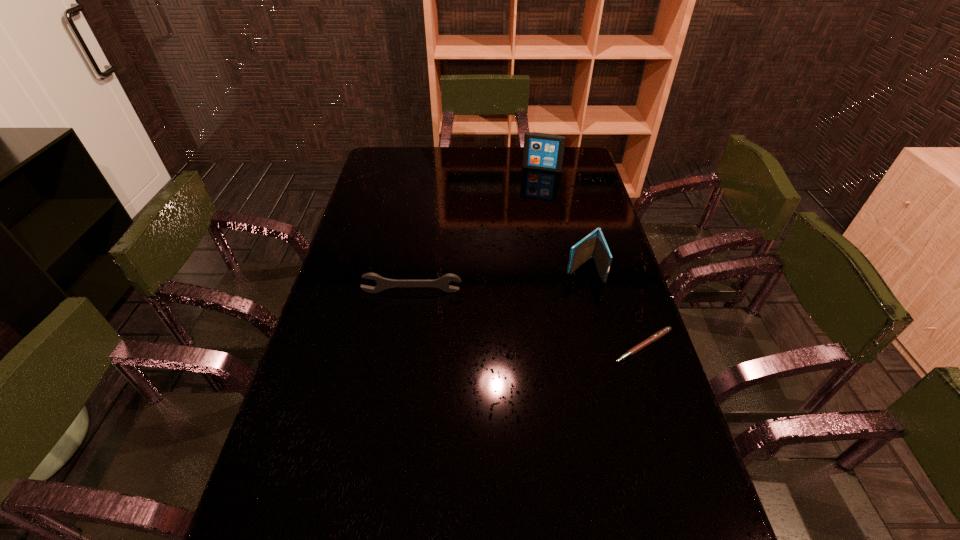
Locate an element on the screen. vacant space located 0.400m on the exterior surface of the wallet is located at coordinates (478, 350).

This screenshot has width=960, height=540. Identify the location of free space located on the exterior surface of the wallet. (558, 290).

The width and height of the screenshot is (960, 540). What are the coordinates of `free space located 0.210m on the exterior surface of the wallet` in the screenshot? It's located at pos(526,314).

I want to click on vacant space located 0.320m on the front screen of the farthest object, so click(x=524, y=217).

This screenshot has width=960, height=540. I want to click on blank space located 0.370m on the front screen of the farthest object, so click(521, 225).

Identify the location of vacant area located on the front screen of the farthest object. (528, 204).

This screenshot has width=960, height=540. Find the location of `object present at the far edge`. object present at the far edge is located at coordinates (542, 151).

The width and height of the screenshot is (960, 540). Find the location of `object that is at the left edge`. object that is at the left edge is located at coordinates point(383,283).

Where is `pen that is at the right edge`? pen that is at the right edge is located at coordinates (664, 331).

Where is `wallet present at the right edge`? Image resolution: width=960 pixels, height=540 pixels. wallet present at the right edge is located at coordinates (594, 245).